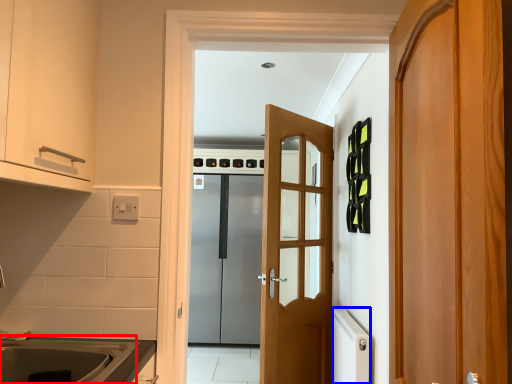
Question: Which of the following is the farthest to the observer, sink (highlighted by a red box) or appliance (highlighted by a blue box)?

Choices:
 (A) sink
 (B) appliance

Answer: (B)